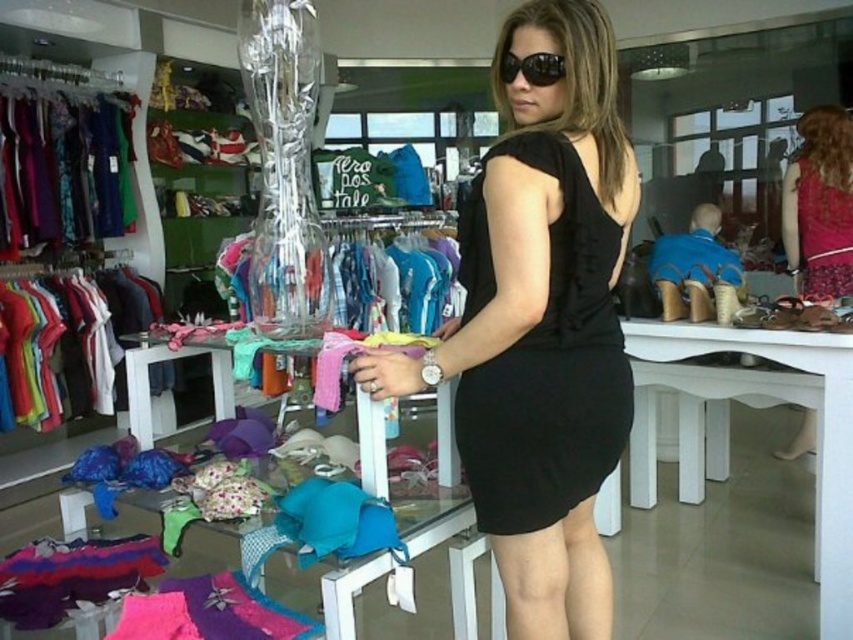
You are a customer in the store and want to know if the floral fabric dress at center can be worn with the black reflective sunglasses at center. Based on their sizes, is there any issue?

The floral fabric dress at center has a larger size compared to black reflective sunglasses at center, but size differences do not affect whether they can be worn together. They can be paired without any issues.

You are a store employee who needs to place a new tag on either the floral fabric dress at center or the black reflective sunglasses at center. Since the tag is only 10 cm wide, which item can the tag fit on without overlapping?

The floral fabric dress at center has a greater width than the black reflective sunglasses at center, so the tag can fit on the floral fabric dress at center without overlapping.